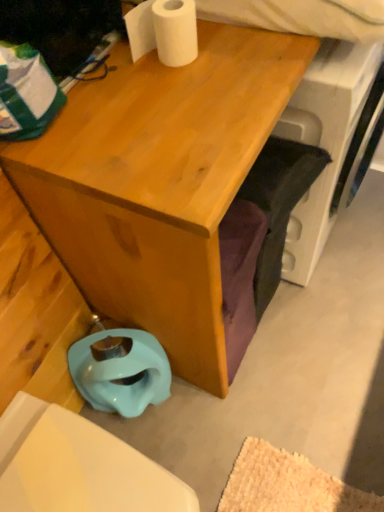
Locate an element on the screen. This screenshot has width=384, height=512. vacant area that is situated to the right of white matte toilet paper at upper center is located at coordinates (244, 52).